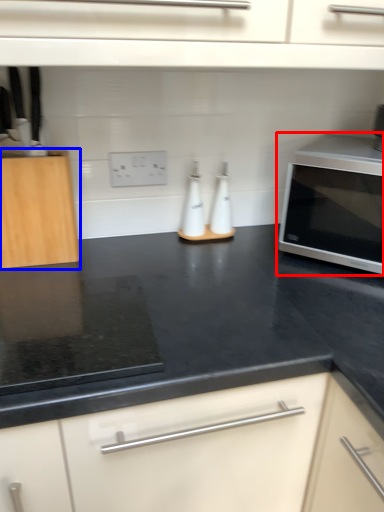
Question: Which point is closer to the camera, microwave oven (highlighted by a red box) or cabinetry (highlighted by a blue box)?

Choices:
 (A) microwave oven
 (B) cabinetry

Answer: (B)